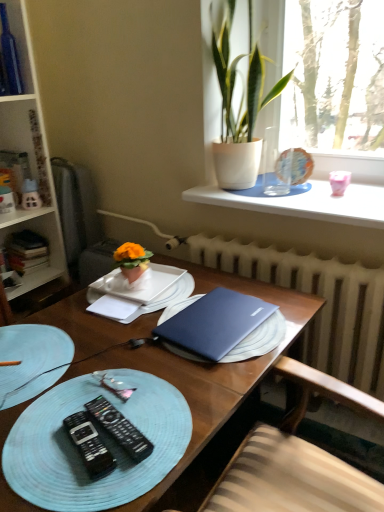
Image resolution: width=384 pixels, height=512 pixels. Find the location of `free area in between matte orange flowerpot at center, the first houseplant from the left, and black plastic remote control at lower left, the first remote control in the right-to-left sequence`. free area in between matte orange flowerpot at center, the first houseplant from the left, and black plastic remote control at lower left, the first remote control in the right-to-left sequence is located at coordinates (127, 364).